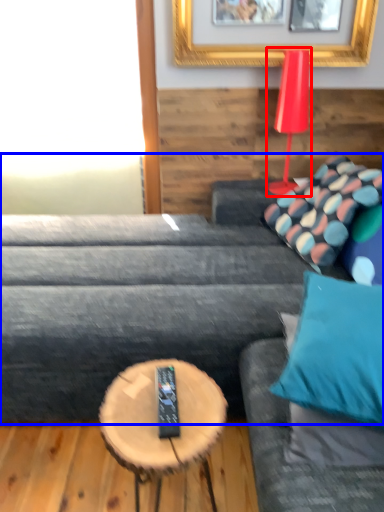
Question: Which point is further to the camera, table lamp (highlighted by a red box) or studio couch (highlighted by a blue box)?

Choices:
 (A) table lamp
 (B) studio couch

Answer: (A)